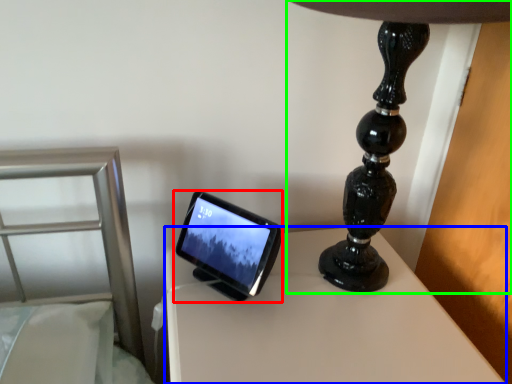
Question: Which is nearer to the tablet computer (highlighted by a red box)? table (highlighted by a blue box) or lamp (highlighted by a green box).

Choices:
 (A) table
 (B) lamp

Answer: (A)